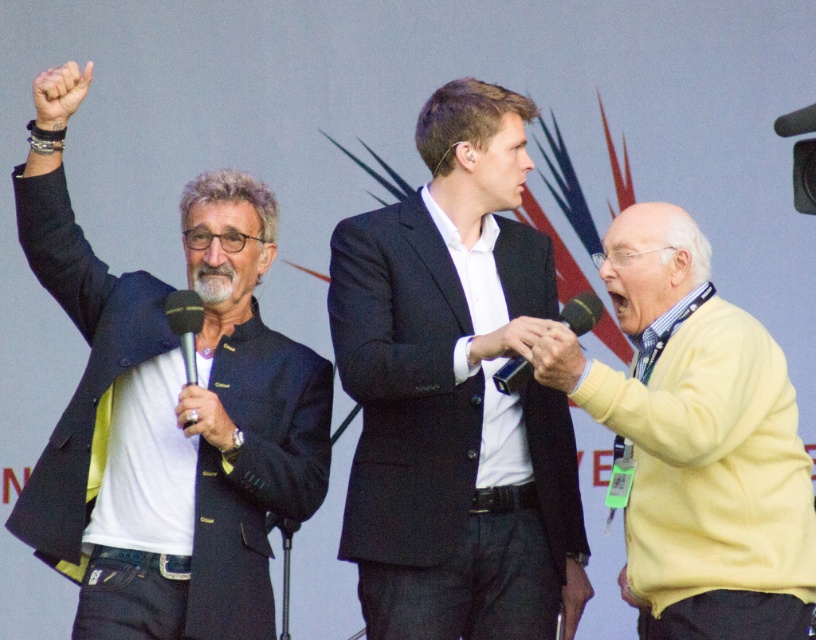
What is the exact coordinate of the black suit jacket at center?

The black suit jacket at center is located at point (455, 394).

You are a photographer setting up a camera to capture the entire scene. The matte black jacket at left and the yellow sweater at right are the main subjects. Based on their positions, which one might require more focus adjustment due to its width?

The matte black jacket at left might require more focus adjustment due to its width compared to the yellow sweater at right.